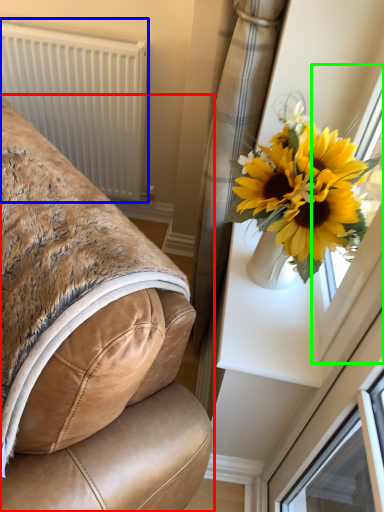
Question: Estimate the real-world distances between objects in this image. Which object is farther from furniture (highlighted by a red box), radiator (highlighted by a blue box) or window frame (highlighted by a green box)?

Choices:
 (A) radiator
 (B) window frame

Answer: (A)